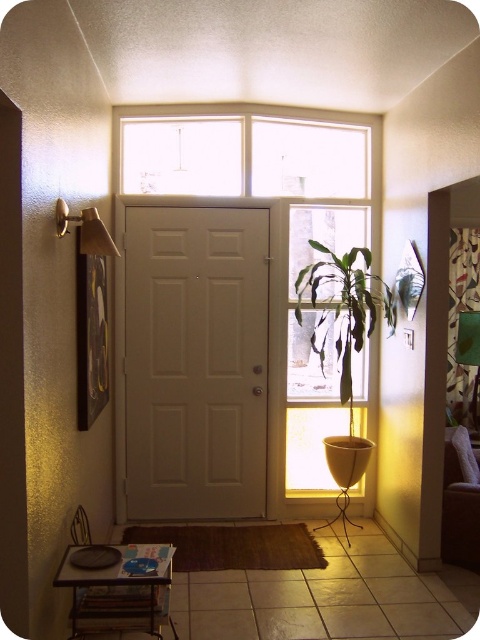
Question: Does white matte door at center have a greater width compared to translucent glass window at center?

Choices:
 (A) no
 (B) yes

Answer: (B)

Question: Does translucent glass window at center appear over green leafy plant at center?

Choices:
 (A) yes
 (B) no

Answer: (B)

Question: Which object is the farthest from the green leafy plant at center?

Choices:
 (A) metallic brass door handle at upper left
 (B) white matte door at center

Answer: (A)

Question: Which point is closer to the camera taking this photo?

Choices:
 (A) click(184, 344)
 (B) click(315, 364)
 (C) click(60, 220)

Answer: (C)

Question: Does white matte door at center appear on the left side of metallic brass door handle at upper left?

Choices:
 (A) yes
 (B) no

Answer: (B)

Question: Which object is positioned farthest from the metallic brass door handle at upper left?

Choices:
 (A) translucent glass window at center
 (B) green leafy plant at center

Answer: (A)